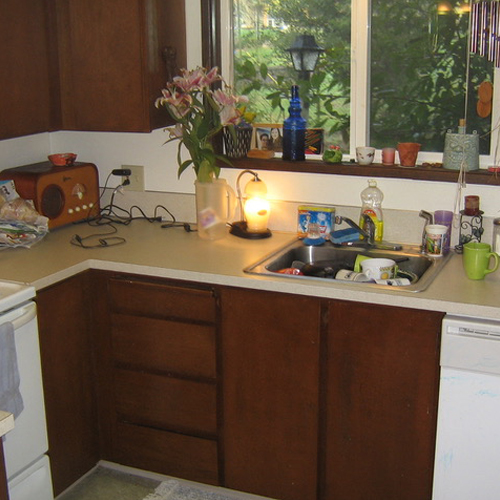
I want to click on dishwasher, so click(x=473, y=410).